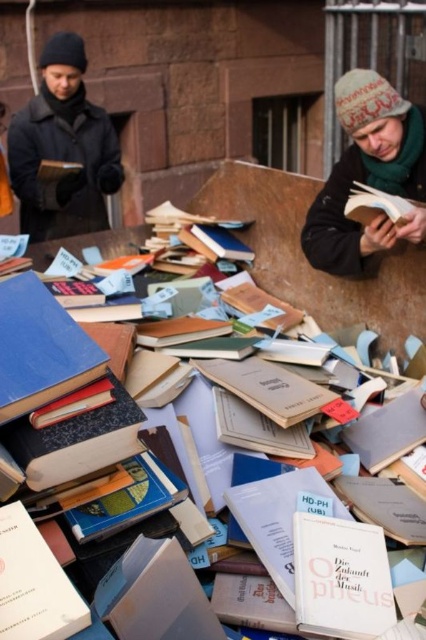
Is dark blue woolen hat at upper left to the left of white paper book at center from the viewer's perspective?

Yes, dark blue woolen hat at upper left is to the left of white paper book at center.

Locate an element on the screen. dark blue woolen hat at upper left is located at coordinates (63, 148).

Locate an element on the screen. Image resolution: width=426 pixels, height=640 pixels. dark blue woolen hat at upper left is located at coordinates click(x=63, y=148).

Find the location of a particular element. The image size is (426, 640). hardcover book at lower left is located at coordinates [x=34, y=582].

Which is above, hardcover book at lower left or hardcover book at center?

hardcover book at center

Between point (19, 577) and point (405, 208), which one is positioned in front?

Point (19, 577)

This screenshot has width=426, height=640. What are the coordinates of `hardcover book at lower left` in the screenshot? It's located at (34, 582).

Can you confirm if knitted wool hat at upper right is thinner than white paper book at center?

Incorrect, knitted wool hat at upper right's width is not less than white paper book at center's.

Which is in front, point (344, 198) or point (339, 541)?

Positioned in front is point (339, 541).

The height and width of the screenshot is (640, 426). Find the location of `knitted wool hat at upper right`. knitted wool hat at upper right is located at coordinates (368, 176).